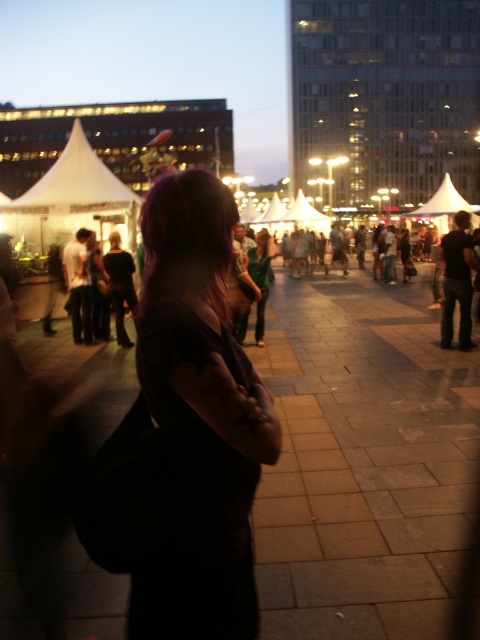
Question: Which object is farther from the camera taking this photo?

Choices:
 (A) matte black dress at center
 (B) white fabric canopy at upper left

Answer: (B)

Question: Is matte black dress at center bigger than white fabric canopy at upper left?

Choices:
 (A) no
 (B) yes

Answer: (A)

Question: Which object is farther from the camera taking this photo?

Choices:
 (A) white fabric canopy at upper left
 (B) matte black dress at center

Answer: (A)

Question: Does matte black dress at center appear on the left side of white fabric canopy at upper left?

Choices:
 (A) yes
 (B) no

Answer: (B)

Question: Which object appears farthest from the camera in this image?

Choices:
 (A) matte black dress at center
 (B) white fabric canopy at upper left

Answer: (B)

Question: Does matte black dress at center have a smaller size compared to white fabric canopy at upper left?

Choices:
 (A) no
 (B) yes

Answer: (B)